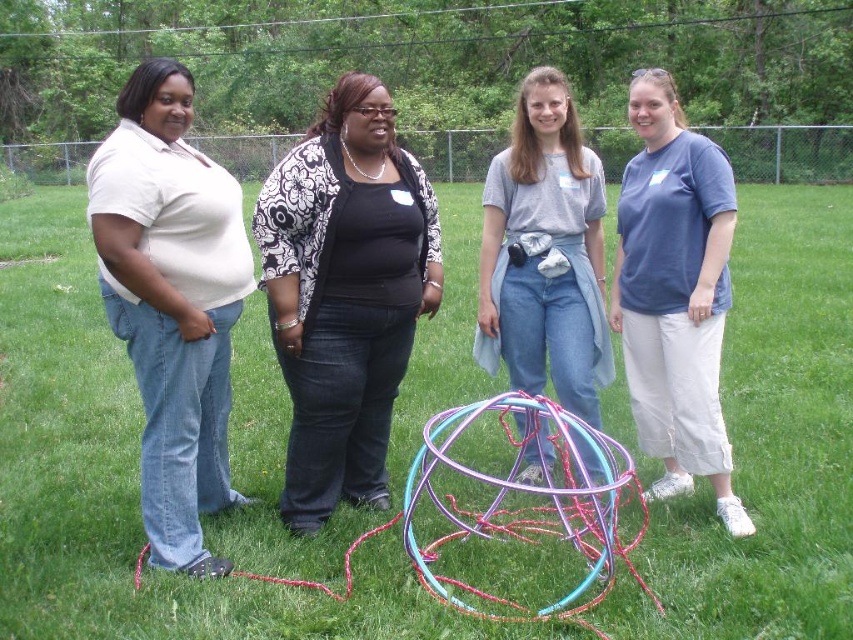
You are standing at the origin point in the park scene. There are two points marked in the image. Which point is closer to you, the point at coordinates point (x=161, y=170) or point (x=556, y=260)?

The point at coordinates point (x=161, y=170) is closer to you because it is in front of point (x=556, y=260).